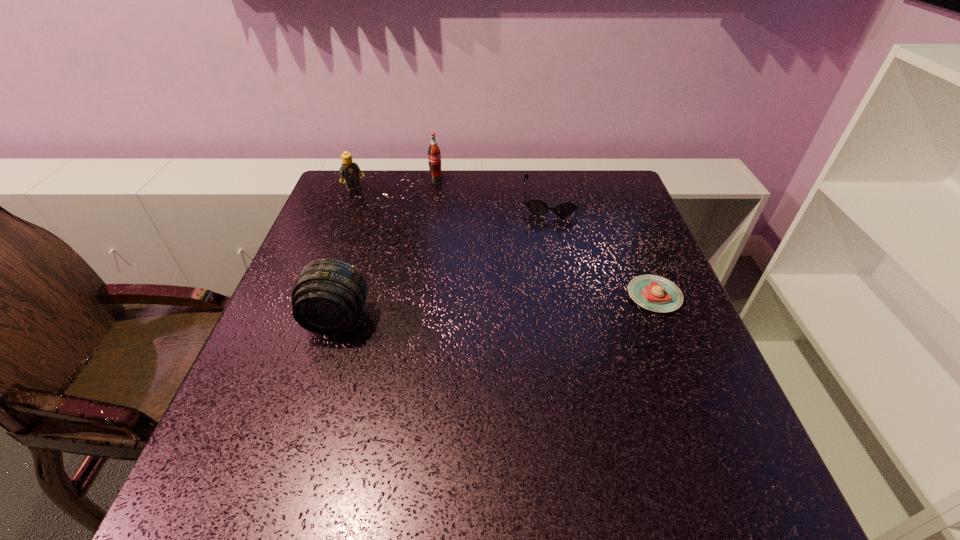
Image resolution: width=960 pixels, height=540 pixels. In order to click on telephoto lens in this screenshot , I will do `click(328, 296)`.

At what (x,y) coordinates should I click in order to perform the action: click on the shortest object. Please return your answer as a coordinate pair (x, y). Looking at the image, I should click on (655, 293).

What are the coordinates of `the rightmost object` in the screenshot? It's located at (655, 293).

Locate an element on the screen. The image size is (960, 540). the third shortest object is located at coordinates (349, 170).

Locate an element on the screen. The height and width of the screenshot is (540, 960). the second shortest object is located at coordinates (563, 209).

Locate an element on the screen. This screenshot has height=540, width=960. the second object from right to left is located at coordinates (563, 209).

This screenshot has width=960, height=540. Identify the location of soda bottle. (434, 155).

Locate an element on the screen. Image resolution: width=960 pixels, height=540 pixels. the third object from right to left is located at coordinates pos(434,155).

Identify the location of vacant space located 0.170m at the front element of the telephoto lens. (307, 416).

At what (x,y) coordinates should I click in order to perform the action: click on blank space located 0.190m on the back of the rightmost object. Please return your answer as a coordinate pair (x, y). The image size is (960, 540). Looking at the image, I should click on (628, 230).